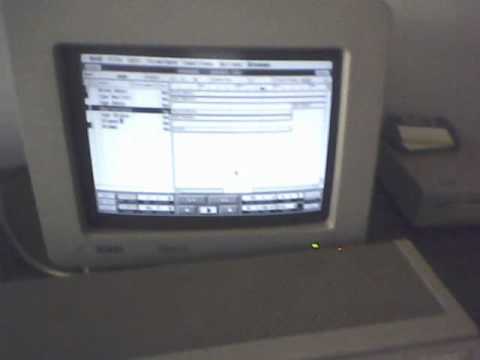
You are a GUI agent. You are given a task and a screenshot of the screen. Output one action in this format:
    pyautogui.click(x=<x>, y=<y>)
    Task: Click on the top center edge of monitor
    The image size is (480, 360).
    Given the screenshot: What is the action you would take?
    pyautogui.click(x=206, y=26)